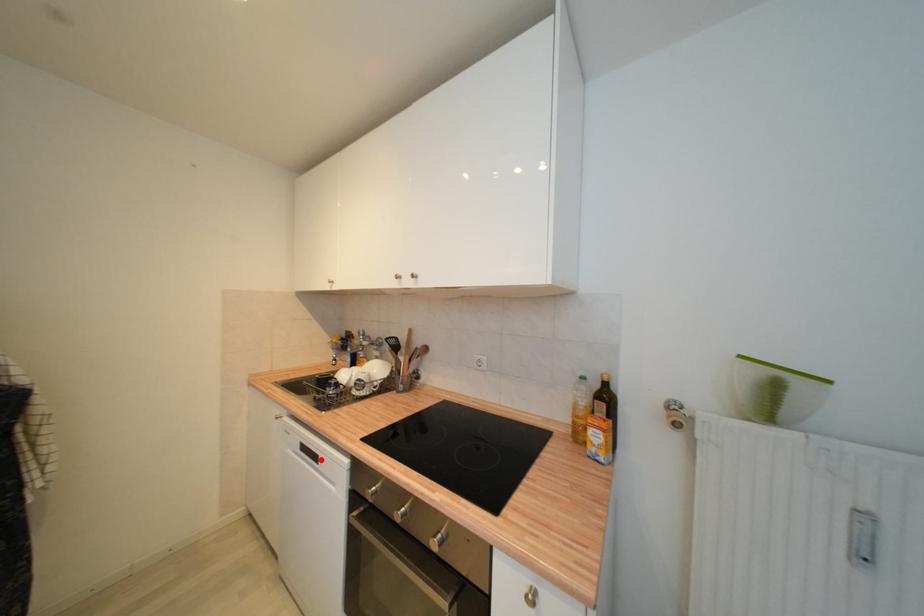
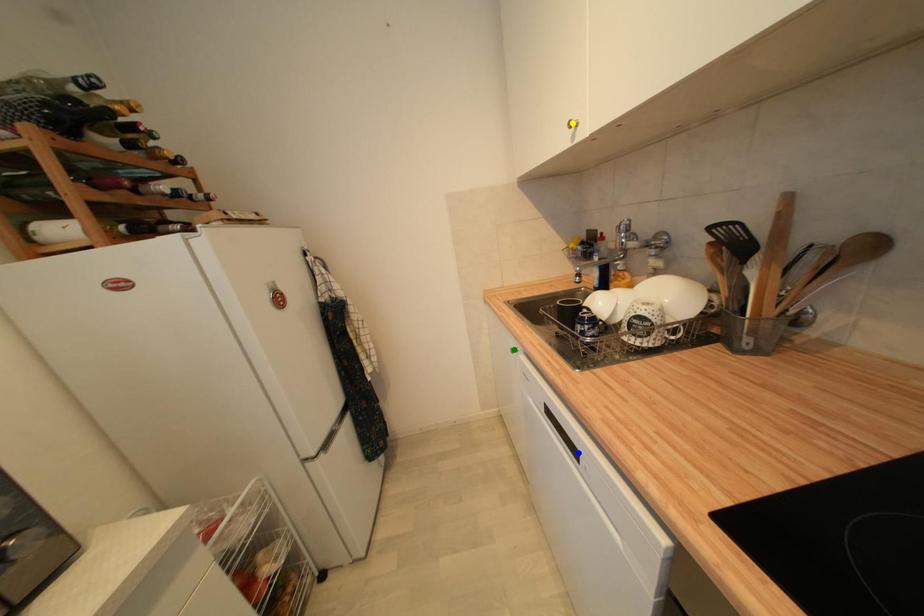
Question: I am providing you with two images of the same scene from different viewpoints. A red point is marked on the first image. You are given multiple points on the second image. In image 2, which mark is for the same physical point as the one in image 1?

Choices:
 (A) blue point
 (B) yellow point
 (C) green point

Answer: (A)